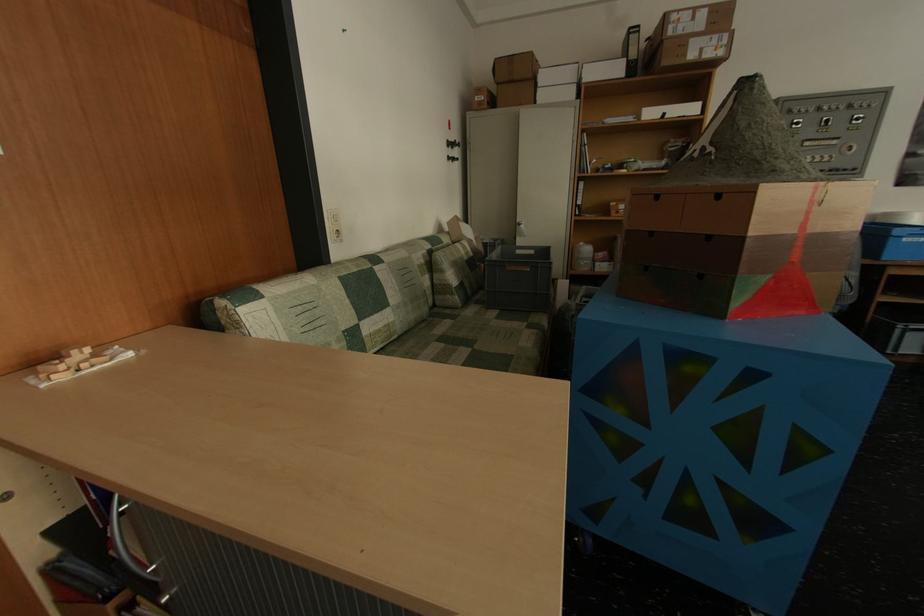
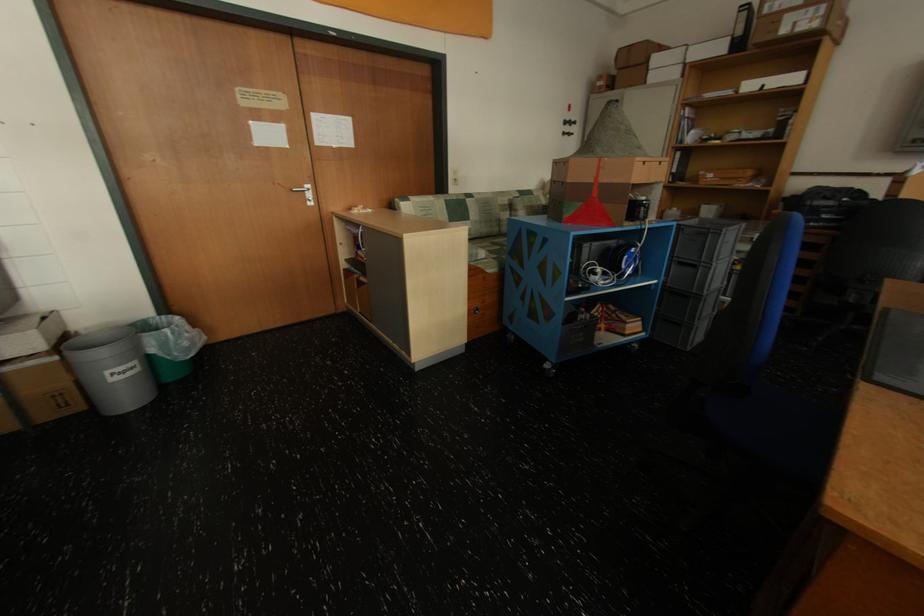
Find the pixel in the second image that matches point 457,160 in the first image.

(573, 135)